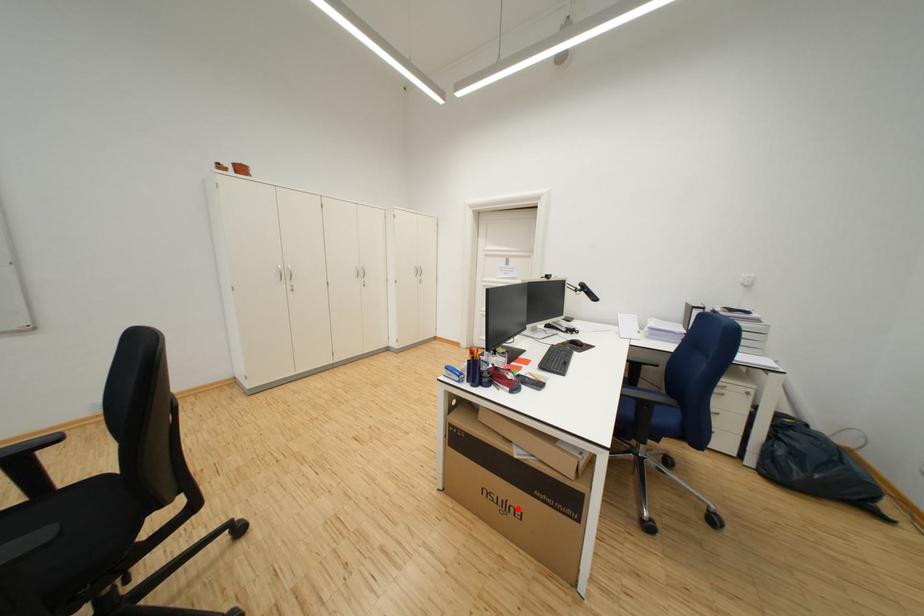
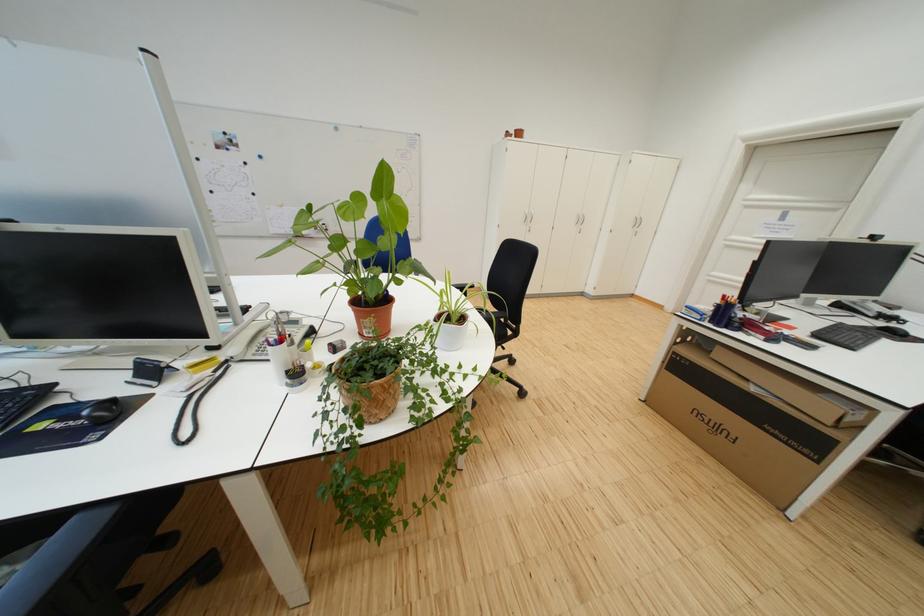
In the second image, find the point that corresponds to the highlighted location in the first image.

(730, 431)